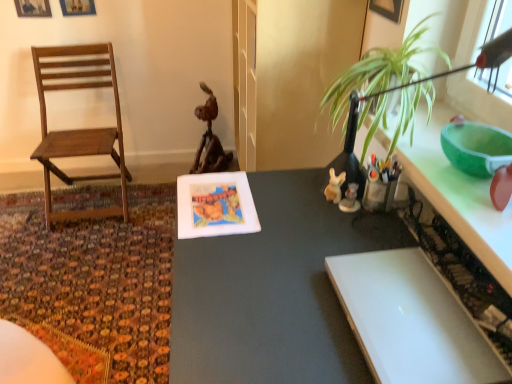
What is the approximate height of green glossy counter top at upper right?

It is 1.44 inches.

Describe the element at coordinates (380, 70) in the screenshot. I see `green leafy plant at upper right` at that location.

Describe the element at coordinates (273, 291) in the screenshot. I see `matte gray table at center` at that location.

The width and height of the screenshot is (512, 384). What do you see at coordinates (334, 186) in the screenshot?
I see `white matte rabbit at center-right, which ranks as the 2th toy in right-to-left order` at bounding box center [334, 186].

How much space does white matte rabbit at center-right, which ranks as the 2th toy in right-to-left order, occupy horizontally?

white matte rabbit at center-right, which ranks as the 2th toy in right-to-left order, is 1.87 inches wide.

Locate an element on the screen. rustic wood statue at center is located at coordinates (209, 139).

Is white glossy figurine at center-right, which is the second toy from left to right, not inside matte gray table at center?

white glossy figurine at center-right, which is the second toy from left to right, lies outside matte gray table at center's area.

From the picture: Is white glossy figurine at center-right, which is the second toy from left to right, turned away from matte gray table at center?

white glossy figurine at center-right, which is the second toy from left to right, is not turned away from matte gray table at center.

Which is in front, point (345, 203) or point (267, 325)?

Point (267, 325)

Which object is thinner, white glossy figurine at center-right, which is the second toy from left to right, or matte gray table at center?

Thinner between the two is white glossy figurine at center-right, which is the second toy from left to right.

Can you confirm if rustic wood statue at center is bigger than wooden chair at left?

Actually, rustic wood statue at center might be smaller than wooden chair at left.

Does rustic wood statue at center appear on the right side of wooden chair at left?

Yes, rustic wood statue at center is to the right of wooden chair at left.

Looking at this image, which is in front, rustic wood statue at center or wooden chair at left?

wooden chair at left is more forward.

Is rustic wood statue at center looking in the opposite direction of wooden chair at left?

That's not correct — rustic wood statue at center is not looking away from wooden chair at left.

Considering the positions of objects green leafy plant at upper right and white matte rabbit at center-right, which ranks as the 2th toy in right-to-left order, in the image provided, who is more to the left, green leafy plant at upper right or white matte rabbit at center-right, which ranks as the 2th toy in right-to-left order,?

white matte rabbit at center-right, which ranks as the 2th toy in right-to-left order.

Who is shorter, green leafy plant at upper right or white matte rabbit at center-right, which ranks as the 2th toy in right-to-left order?

Standing shorter between the two is white matte rabbit at center-right, which ranks as the 2th toy in right-to-left order.

Which is further, (378, 102) or (334, 173)?

The point (378, 102) is behind.

Is green leafy plant at upper right surrounding white matte rabbit at center-right, which is the first toy from left to right?

Indeed, white matte rabbit at center-right, which is the first toy from left to right, is located within green leafy plant at upper right.

Is white matte rabbit at center-right, which ranks as the 2th toy in right-to-left order, facing towards rustic wood statue at center?

No, white matte rabbit at center-right, which ranks as the 2th toy in right-to-left order, is not aimed at rustic wood statue at center.

Between point (335, 180) and point (210, 152), which one is positioned in front?

The point (335, 180) is closer to the camera.

Which of these two, white matte rabbit at center-right, which is the first toy from left to right, or rustic wood statue at center, is wider?

With larger width is rustic wood statue at center.

Is white matte rabbit at center-right, which is the first toy from left to right, positioned beyond the bounds of rustic wood statue at center?

Absolutely, white matte rabbit at center-right, which is the first toy from left to right, is external to rustic wood statue at center.

Can you see wooden chair at left touching matte gray table at center?

No, wooden chair at left is not next to matte gray table at center.

Based on the photo, considering the sizes of objects wooden chair at left and matte gray table at center in the image provided, who is thinner, wooden chair at left or matte gray table at center?

wooden chair at left is thinner.

Is wooden chair at left smaller than matte gray table at center?

Yes.

Is wooden chair at left closer to camera compared to matte gray table at center?

No, it is behind matte gray table at center.

Relative to wooden chair at left, is green leafy plant at upper right in front or behind?

Visually, green leafy plant at upper right is located in front of wooden chair at left.

From the image's perspective, which is below, green leafy plant at upper right or wooden chair at left?

green leafy plant at upper right.

From a real-world perspective, who is located lower, green leafy plant at upper right or wooden chair at left?

wooden chair at left is physically lower.

Which is closer to the camera, (368, 95) or (98, 57)?

Point (368, 95).

From the picture: From the image's perspective, is green leafy plant at upper right located above or below green glossy counter top at upper right?

green leafy plant at upper right is above green glossy counter top at upper right.

From their relative heights in the image, would you say green leafy plant at upper right is taller or shorter than green glossy counter top at upper right?

In the image, green leafy plant at upper right appears to be taller than green glossy counter top at upper right.

Which is further, (395,141) or (445,116)?

Positioned behind is point (445,116).

Consider the image. Is green glossy counter top at upper right located within green leafy plant at upper right?

Actually, green glossy counter top at upper right is outside green leafy plant at upper right.

Starting from the matte gray table at center, which toy is the 2nd one to the right? Please provide its 2D coordinates.

[(350, 199)]

I want to click on chair that appears on the left of rustic wood statue at center, so click(79, 129).

Looking at the image, which one is located further to rustic wood statue at center, white glossy figurine at center-right, which is the second toy from left to right, or white matte rabbit at center-right, which is the first toy from left to right?

white glossy figurine at center-right, which is the second toy from left to right.

When comparing their distances from matte gray table at center, does green leafy plant at upper right or wooden chair at left seem closer?

green leafy plant at upper right is closer to matte gray table at center.

From the image, which object appears to be nearer to wooden chair at left, white matte rabbit at center-right, which is the first toy from left to right, or green glossy counter top at upper right?

Based on the image, white matte rabbit at center-right, which is the first toy from left to right, appears to be nearer to wooden chair at left.

Estimate the real-world distances between objects in this image. Which object is further from rustic wood statue at center, green leafy plant at upper right or green glossy counter top at upper right?

green glossy counter top at upper right.

From the image, which object appears to be nearer to green leafy plant at upper right, wooden chair at left or rustic wood statue at center?

Based on the image, rustic wood statue at center appears to be nearer to green leafy plant at upper right.

From the image, which object appears to be farther from white matte rabbit at center-right, which is the first toy from left to right, rustic wood statue at center or green glossy counter top at upper right?

The object further to white matte rabbit at center-right, which is the first toy from left to right, is rustic wood statue at center.

Based on their spatial positions, is white matte rabbit at center-right, which ranks as the 2th toy in right-to-left order, or matte gray table at center further from rustic wood statue at center?

Among the two, matte gray table at center is located further to rustic wood statue at center.

Which object lies further to the anchor point wooden chair at left, rustic wood statue at center or white matte rabbit at center-right, which ranks as the 2th toy in right-to-left order?

Among the two, white matte rabbit at center-right, which ranks as the 2th toy in right-to-left order, is located further to wooden chair at left.

You are a GUI agent. You are given a task and a screenshot of the screen. Output one action in this format:
    pyautogui.click(x=<x>, y=<y>)
    Task: Click on the chair between white glossy figurine at center-right, the 1th toy from the right, and rustic wood statue at center, along the z-axis
    This screenshot has width=512, height=384.
    Given the screenshot: What is the action you would take?
    pyautogui.click(x=79, y=129)

At what (x,y) coordinates should I click in order to perform the action: click on toy located between wooden chair at left and white glossy figurine at center-right, which is the second toy from left to right, in the left-right direction. Please return your answer as a coordinate pair (x, y). Looking at the image, I should click on (334, 186).

This screenshot has width=512, height=384. Identify the location of chair between matte gray table at center and rustic wood statue at center along the z-axis. (79, 129).

The width and height of the screenshot is (512, 384). Identify the location of toy between green leafy plant at upper right and white glossy figurine at center-right, the 1th toy from the right, in the up-down direction. (334, 186).